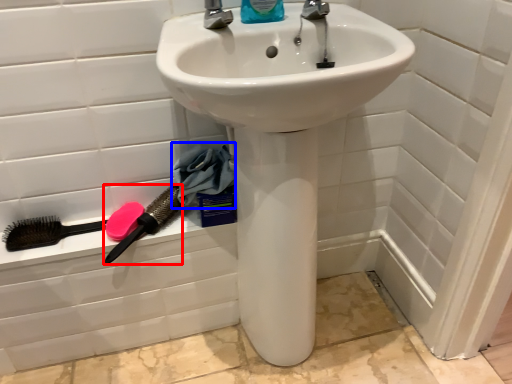
Question: Among these objects, which one is nearest to the camera, brush (highlighted by a red box) or material (highlighted by a blue box)?

Choices:
 (A) brush
 (B) material

Answer: (A)